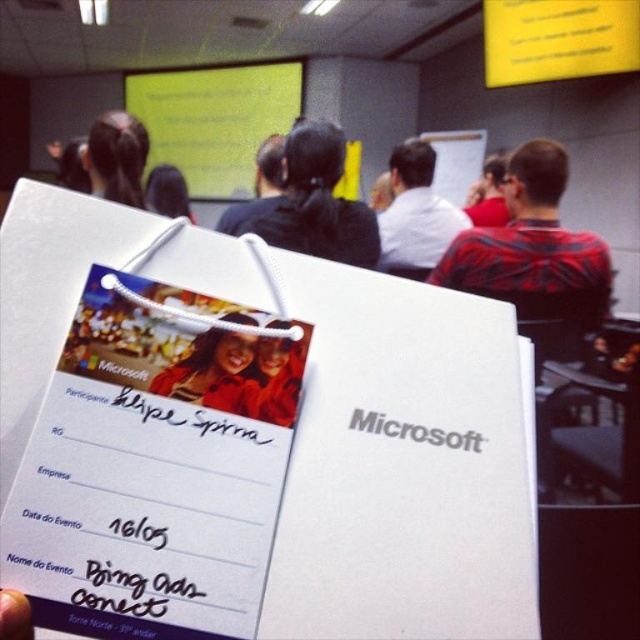
Question: Observing the image, what is the correct spatial positioning of matte red shirt at center in reference to matte black shirt at upper center?

Choices:
 (A) left
 (B) right

Answer: (A)

Question: Which of these objects is positioned farthest from the red and black striped shirt at upper right?

Choices:
 (A) matte black shirt at upper center
 (B) black hair at center
 (C) matte red shirt at center
 (D) matte red sweater at center

Answer: (C)

Question: Does white shirt at upper center have a greater width compared to black hair at upper left?

Choices:
 (A) no
 (B) yes

Answer: (B)

Question: Among these points, which one is nearest to the camera?

Choices:
 (A) (394, 216)
 (B) (156, 380)

Answer: (B)

Question: Does red and black striped shirt at upper right appear over white shirt at upper center?

Choices:
 (A) no
 (B) yes

Answer: (A)

Question: Which of the following is the closest to the observer?

Choices:
 (A) (433, 221)
 (B) (244, 381)
 (C) (177, 209)
 (D) (486, 205)

Answer: (B)